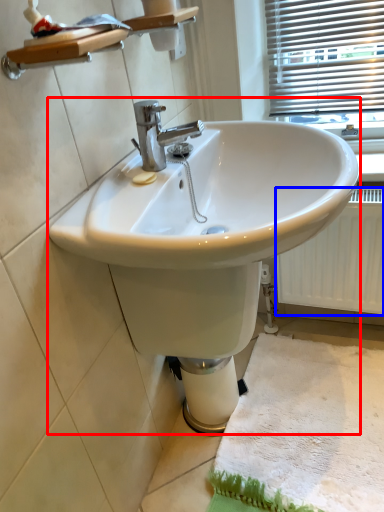
Question: Which object is further to the camera taking this photo, sink (highlighted by a red box) or radiator (highlighted by a blue box)?

Choices:
 (A) sink
 (B) radiator

Answer: (B)